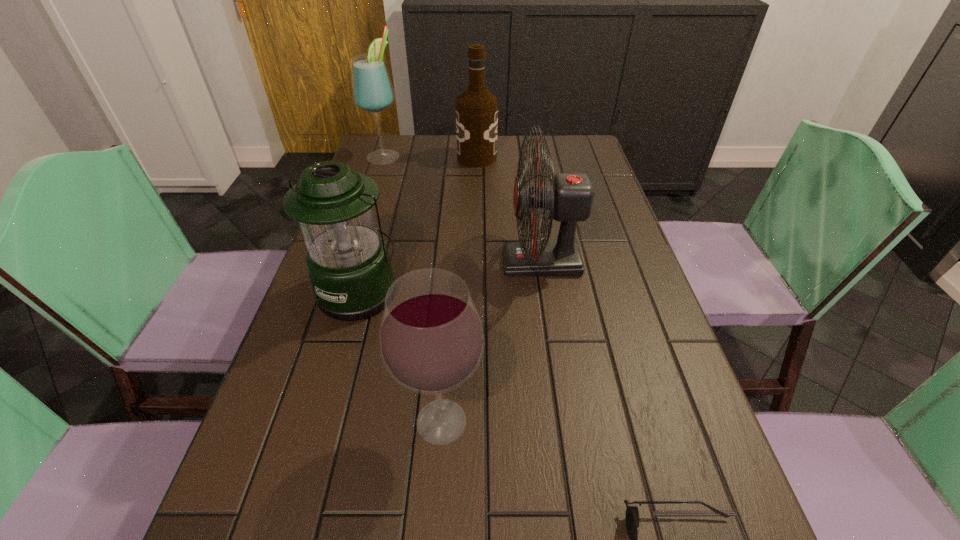
At what (x,y) coordinates should I click in order to perform the action: click on the leftmost alcohol. Please return your answer as a coordinate pair (x, y). This screenshot has width=960, height=540. Looking at the image, I should click on pyautogui.click(x=372, y=91).

Find the location of `fan`. fan is located at coordinates (569, 197).

Where is `lantern`? lantern is located at coordinates (348, 263).

The width and height of the screenshot is (960, 540). In order to click on the nearest alcohol in this screenshot , I will do `click(431, 338)`.

Find the location of `vacant region located on the front of the leftmost alcohol`. vacant region located on the front of the leftmost alcohol is located at coordinates (360, 230).

Identify the location of free space located on the front-facing side of the fan. This screenshot has height=540, width=960. (406, 262).

Find the location of a particular element. This screenshot has width=960, height=540. vacant region located on the front-facing side of the fan is located at coordinates (483, 262).

At what (x,y) coordinates should I click in order to perform the action: click on vacant space located 0.190m on the front-facing side of the fan. Please return your answer as a coordinate pair (x, y). The height and width of the screenshot is (540, 960). Looking at the image, I should click on (426, 262).

Find the location of a particular element. vacant region located 0.360m on the front of the lantern is located at coordinates (300, 501).

At what (x,y) coordinates should I click in order to perform the action: click on vacant space situated 0.190m on the right of the fifth farthest object. Please return your answer as a coordinate pair (x, y). Image resolution: width=960 pixels, height=540 pixels. Looking at the image, I should click on (592, 422).